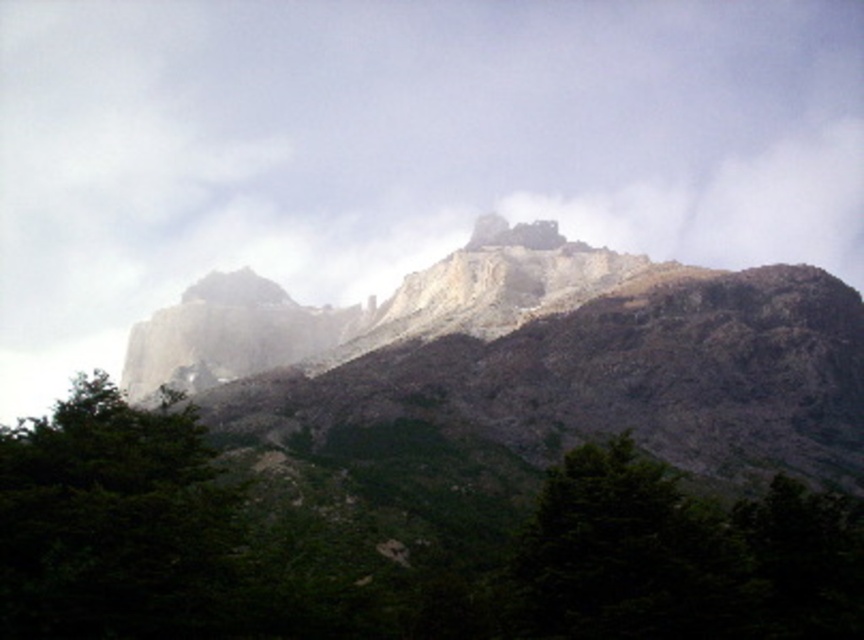
You are a hiker planning to climb the rugged stone mountain at center from the green matte tree at lower center. What is the approximate distance you need to cover to reach the mountain?

The rugged stone mountain at center is 117.41 meters from the green matte tree at lower center, so the approximate distance you need to cover to reach the mountain is 117.41 meters.

You are a hiker planning to take a photo of the white foggy cloud at upper center. You are currently standing at the point with coordinates point (410, 140). Is the white foggy cloud at upper center visible from your current position?

The point (410, 140) marks the white foggy cloud at upper center, so you are already at the location of the white foggy cloud at upper center. Therefore, it is not visible from your current position because you are standing on it.

From the picture: You are a hiker planning to take a photo of the rugged stone mountain at center from the base of the mountain. However, there is a white foggy cloud at upper center in your view. Will the mountain be fully visible in your photo?

The rugged stone mountain at center is behind the white foggy cloud at upper center, so part of the mountain will be obscured by the cloud in the photo.